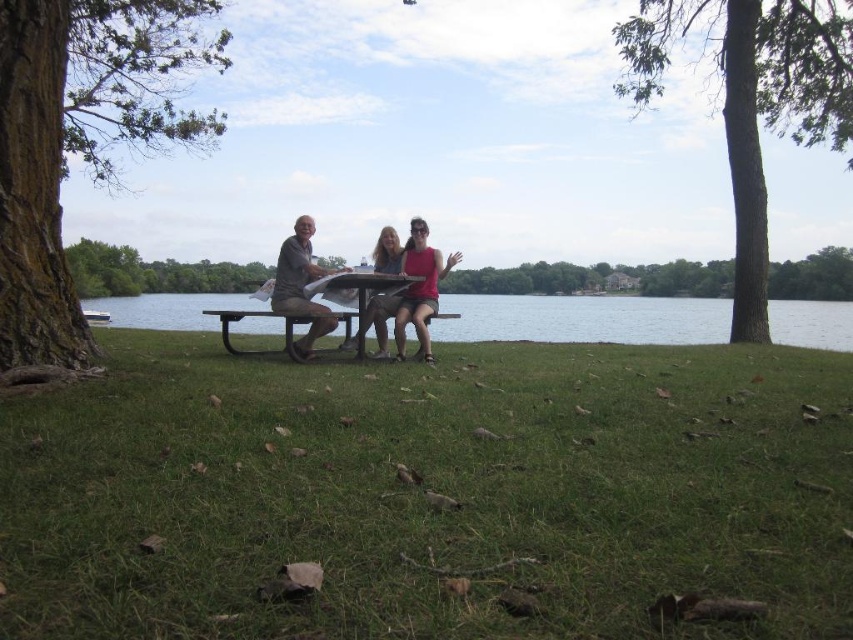
Which of these two, matte pink tank top at center or matte gray shorts at center, stands shorter?

matte gray shorts at center

In the scene shown: Is matte pink tank top at center below matte gray shorts at center?

Actually, matte pink tank top at center is above matte gray shorts at center.

Between point (434, 296) and point (381, 333), which one is positioned behind?

Positioned behind is point (381, 333).

I want to click on matte pink tank top at center, so click(421, 289).

Can you confirm if clear water at center is taller than matte brown shirt at center?

Yes.

Locate an element on the screen. The height and width of the screenshot is (640, 853). clear water at center is located at coordinates (584, 317).

This screenshot has width=853, height=640. In order to click on clear water at center in this screenshot , I will do `click(584, 317)`.

Is green rough bark tree at upper right taller than clear water at center?

Correct, green rough bark tree at upper right is much taller as clear water at center.

Is point (815, 10) closer to camera compared to point (566, 324)?

Yes, point (815, 10) is in front of point (566, 324).

Is point (793, 131) positioned before point (711, 305)?

No, it is not.

Locate an element on the screen. Image resolution: width=853 pixels, height=640 pixels. green rough bark tree at upper right is located at coordinates (752, 100).